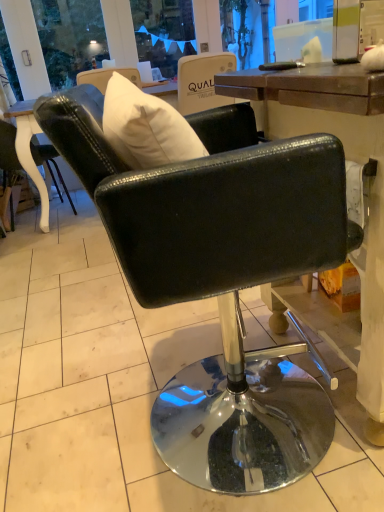
Image resolution: width=384 pixels, height=512 pixels. I want to click on glossy black chair at center, the first chair positioned from the front, so click(x=219, y=282).

This screenshot has height=512, width=384. What do you see at coordinates (219, 282) in the screenshot?
I see `glossy black chair at center, which is counted as the 2th chair, starting from the left` at bounding box center [219, 282].

How much space does black leather chair at left, placed as the 1th chair when sorted from left to right, occupy vertically?

It is 34.23 inches.

This screenshot has width=384, height=512. Identify the location of black leather chair at left, placed as the 1th chair when sorted from left to right. (8, 151).

This screenshot has height=512, width=384. What do you see at coordinates (8, 151) in the screenshot? I see `black leather chair at left, placed as the 1th chair when sorted from left to right` at bounding box center [8, 151].

Identify the location of glossy black chair at center, the first chair positioned from the front. (219, 282).

Can you confirm if black leather chair at left, placed as the 1th chair when sorted from left to right, is positioned to the left of glossy black chair at center, the first chair from the right?

Indeed, black leather chair at left, placed as the 1th chair when sorted from left to right, is positioned on the left side of glossy black chair at center, the first chair from the right.

Which is in front, black leather chair at left, acting as the second chair starting from the front, or glossy black chair at center, which is counted as the 2th chair, starting from the left?

glossy black chair at center, which is counted as the 2th chair, starting from the left, is more forward.

Does point (10, 182) lie behind point (109, 155)?

Yes, it is behind point (109, 155).

From the image's perspective, which one is positioned higher, black leather chair at left, placed as the 2th chair when sorted from right to left, or glossy black chair at center, which ranks as the second chair in back-to-front order?

black leather chair at left, placed as the 2th chair when sorted from right to left, is shown above in the image.

From a real-world perspective, is black leather chair at left, which ranks as the 1th chair in back-to-front order, physically below glossy black chair at center, which ranks as the second chair in back-to-front order?

Yes, from a real-world perspective, black leather chair at left, which ranks as the 1th chair in back-to-front order, is beneath glossy black chair at center, which ranks as the second chair in back-to-front order.

From the picture: Can you confirm if black leather chair at left, placed as the 1th chair when sorted from left to right, is wider than glossy black chair at center, the first chair positioned from the front?

In fact, black leather chair at left, placed as the 1th chair when sorted from left to right, might be narrower than glossy black chair at center, the first chair positioned from the front.

Considering the sizes of objects black leather chair at left, placed as the 1th chair when sorted from left to right, and glossy black chair at center, which ranks as the second chair in back-to-front order, in the image provided, who is taller, black leather chair at left, placed as the 1th chair when sorted from left to right, or glossy black chair at center, which ranks as the second chair in back-to-front order,?

glossy black chair at center, which ranks as the second chair in back-to-front order.

Can you confirm if black leather chair at left, placed as the 2th chair when sorted from right to left, is bigger than glossy black chair at center, the first chair positioned from the front?

No, black leather chair at left, placed as the 2th chair when sorted from right to left, is not bigger than glossy black chair at center, the first chair positioned from the front.

Is black leather chair at left, acting as the second chair starting from the front, spatially inside glossy black chair at center, the first chair positioned from the front, or outside of it?

black leather chair at left, acting as the second chair starting from the front, is spatially situated outside glossy black chair at center, the first chair positioned from the front.

Is black leather chair at left, acting as the second chair starting from the front, turned away from glossy black chair at center, the first chair from the right?

No, black leather chair at left, acting as the second chair starting from the front,'s orientation is not away from glossy black chair at center, the first chair from the right.

How many degrees apart are the facing directions of black leather chair at left, placed as the 1th chair when sorted from left to right, and glossy black chair at center, the first chair positioned from the front?

The facing directions of black leather chair at left, placed as the 1th chair when sorted from left to right, and glossy black chair at center, the first chair positioned from the front, are 0.000576 degrees apart.

How much distance is there between black leather chair at left, acting as the second chair starting from the front, and glossy black chair at center, which is counted as the 2th chair, starting from the left?

black leather chair at left, acting as the second chair starting from the front, is 2.12 meters away from glossy black chair at center, which is counted as the 2th chair, starting from the left.

Image resolution: width=384 pixels, height=512 pixels. Identify the location of chair on the right of the black leather chair at left, placed as the 2th chair when sorted from right to left. (219, 282).

Which is more to the right, glossy black chair at center, which is counted as the 2th chair, starting from the left, or black leather chair at left, placed as the 2th chair when sorted from right to left?

glossy black chair at center, which is counted as the 2th chair, starting from the left, is more to the right.

Does glossy black chair at center, the first chair positioned from the front, come behind black leather chair at left, placed as the 1th chair when sorted from left to right?

No, glossy black chair at center, the first chair positioned from the front, is in front of black leather chair at left, placed as the 1th chair when sorted from left to right.

Which is closer, [294,406] or [76,212]?

Point [294,406]

From the image's perspective, does glossy black chair at center, which ranks as the second chair in back-to-front order, appear higher than black leather chair at left, acting as the second chair starting from the front?

No, from the image's perspective, glossy black chair at center, which ranks as the second chair in back-to-front order, is not over black leather chair at left, acting as the second chair starting from the front.

Based on the photo, from a real-world perspective, which is physically above, glossy black chair at center, the first chair from the right, or black leather chair at left, which ranks as the 1th chair in back-to-front order?

From a 3D spatial view, glossy black chair at center, the first chair from the right, is above.

Does glossy black chair at center, the first chair from the right, have a lesser width compared to black leather chair at left, acting as the second chair starting from the front?

No.

Which of these two, glossy black chair at center, which ranks as the second chair in back-to-front order, or black leather chair at left, acting as the second chair starting from the front, stands taller?

Standing taller between the two is glossy black chair at center, which ranks as the second chair in back-to-front order.

Does glossy black chair at center, which ranks as the second chair in back-to-front order, have a larger size compared to black leather chair at left, acting as the second chair starting from the front?

Correct, glossy black chair at center, which ranks as the second chair in back-to-front order, is larger in size than black leather chair at left, acting as the second chair starting from the front.

Is glossy black chair at center, the first chair positioned from the front, completely or partially outside of black leather chair at left, placed as the 1th chair when sorted from left to right?

Yes, glossy black chair at center, the first chair positioned from the front, is outside of black leather chair at left, placed as the 1th chair when sorted from left to right.

Is glossy black chair at center, which ranks as the second chair in back-to-front order, not close to black leather chair at left, placed as the 2th chair when sorted from right to left?

glossy black chair at center, which ranks as the second chair in back-to-front order, is far away from black leather chair at left, placed as the 2th chair when sorted from right to left.

Could you tell me if glossy black chair at center, which ranks as the second chair in back-to-front order, is turned towards black leather chair at left, which ranks as the 1th chair in back-to-front order?

No, glossy black chair at center, which ranks as the second chair in back-to-front order, is not aimed at black leather chair at left, which ranks as the 1th chair in back-to-front order.

Can you tell me how much glossy black chair at center, which is counted as the 2th chair, starting from the left, and black leather chair at left, which ranks as the 1th chair in back-to-front order, differ in facing direction?

The angular difference between glossy black chair at center, which is counted as the 2th chair, starting from the left, and black leather chair at left, which ranks as the 1th chair in back-to-front order, is 0.000576 degrees.

You are a GUI agent. You are given a task and a screenshot of the screen. Output one action in this format:
    pyautogui.click(x=<x>, y=<y>)
    Task: Click on the chair located behind the glossy black chair at center, which is counted as the 2th chair, starting from the left
    The image size is (384, 512).
    Given the screenshot: What is the action you would take?
    pyautogui.click(x=8, y=151)

Locate an element on the screen. This screenshot has height=512, width=384. chair below the black leather chair at left, placed as the 1th chair when sorted from left to right (from the image's perspective) is located at coordinates (219, 282).

Where is `chair that is in front of the black leather chair at left, acting as the second chair starting from the front`? chair that is in front of the black leather chair at left, acting as the second chair starting from the front is located at coordinates (219, 282).